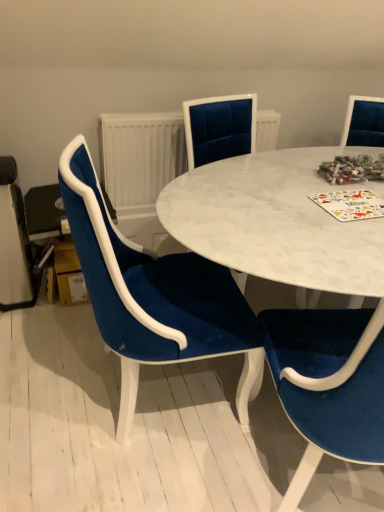
Image resolution: width=384 pixels, height=512 pixels. I want to click on empty space that is ontop of white textured radiator at center (from a real-world perspective), so click(149, 111).